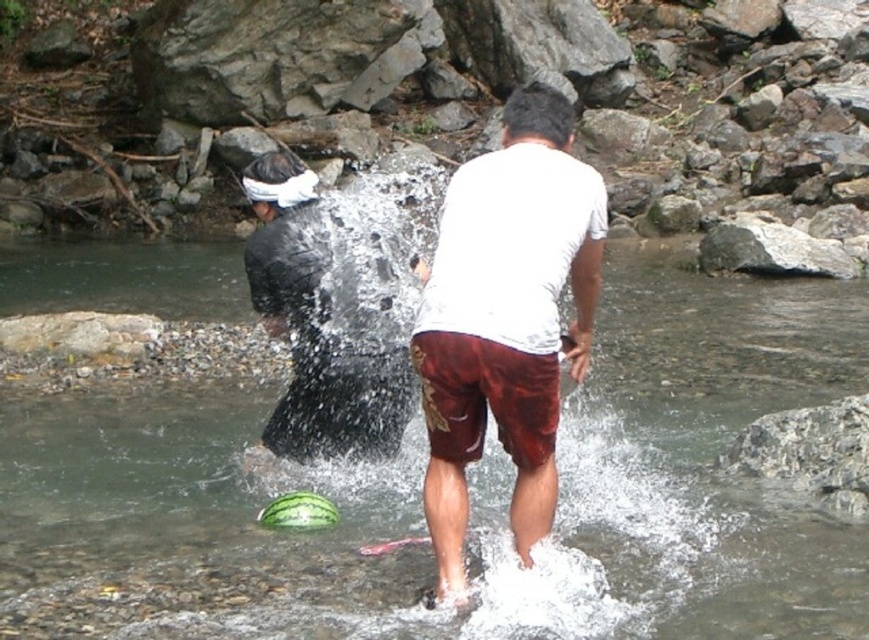
Does clear water stream at center appear under gray rock at upper center?

Correct, clear water stream at center is located below gray rock at upper center.

Can you confirm if clear water stream at center is wider than gray rock at upper center?

Yes.

Who is more distant from viewer, (383, 481) or (780, 257)?

The point (780, 257) is behind.

This screenshot has height=640, width=869. Identify the location of clear water stream at center. (469, 492).

Does white cotton t-shirt at center appear on the left side of gray rock at upper center?

Indeed, white cotton t-shirt at center is positioned on the left side of gray rock at upper center.

Does white cotton t-shirt at center have a lesser width compared to gray rock at upper center?

Indeed, white cotton t-shirt at center has a lesser width compared to gray rock at upper center.

I want to click on white cotton t-shirt at center, so click(506, 317).

Does clear water stream at center appear on the left side of white cotton t-shirt at center?

Correct, you'll find clear water stream at center to the left of white cotton t-shirt at center.

Is point (503, 541) more distant than point (421, 323)?

Yes, it is behind point (421, 323).

This screenshot has height=640, width=869. Find the location of `clear water stream at center`. clear water stream at center is located at coordinates (469, 492).